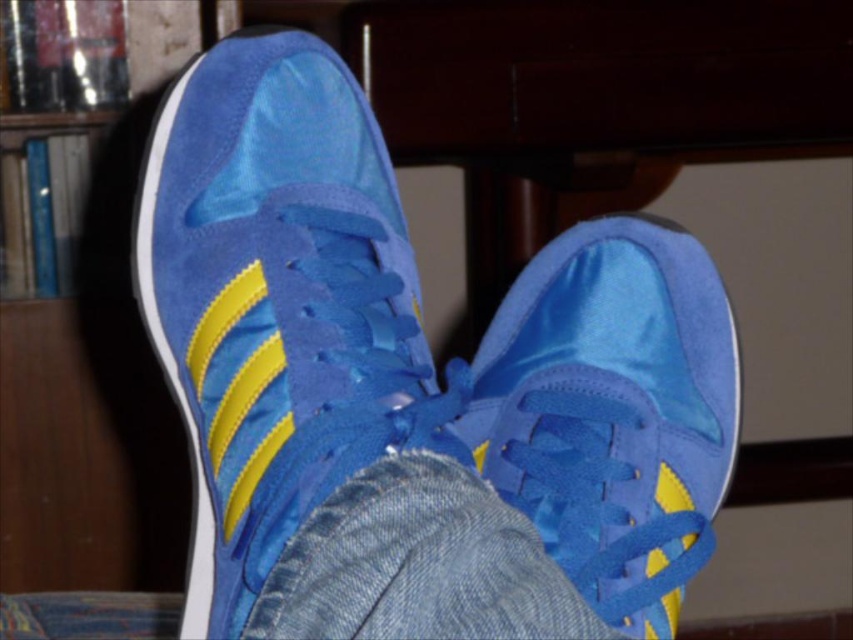
Question: Can you confirm if satin blue sneaker at center is positioned to the right of blue suede shoe at center?

Choices:
 (A) no
 (B) yes

Answer: (A)

Question: Estimate the real-world distances between objects in this image. Which object is closer to the matte wood bookshelf at left?

Choices:
 (A) blue suede shoe at center
 (B) satin blue sneaker at center

Answer: (B)

Question: Which point is farther to the camera?

Choices:
 (A) matte wood bookshelf at left
 (B) blue suede shoe at center
 (C) satin blue sneaker at center

Answer: (A)

Question: Does satin blue sneaker at center lie behind matte wood bookshelf at left?

Choices:
 (A) no
 (B) yes

Answer: (A)

Question: Is blue suede shoe at center to the left of matte wood bookshelf at left from the viewer's perspective?

Choices:
 (A) no
 (B) yes

Answer: (A)

Question: Estimate the real-world distances between objects in this image. Which object is farther from the blue suede shoe at center?

Choices:
 (A) matte wood bookshelf at left
 (B) satin blue sneaker at center

Answer: (A)